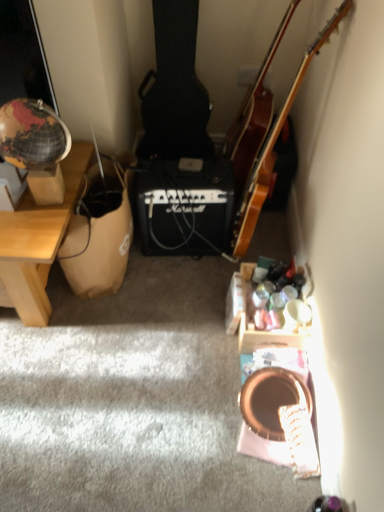
Find the location of a particular element. The width and height of the screenshot is (384, 512). wooden desk at left is located at coordinates (38, 241).

Identify the location of wooden acoustic guitar at upper right. The height and width of the screenshot is (512, 384). (254, 115).

The width and height of the screenshot is (384, 512). What do you see at coordinates (98, 236) in the screenshot?
I see `brown paper bag at left` at bounding box center [98, 236].

Find the location of `wooden desk at left`. wooden desk at left is located at coordinates (38, 241).

In terms of width, does wooden acoustic guitar at upper right look wider or thinner when compared to wooden desk at left?

wooden acoustic guitar at upper right is thinner than wooden desk at left.

Which object is positioned more to the right, wooden acoustic guitar at upper right or wooden desk at left?

wooden acoustic guitar at upper right.

From a real-world perspective, is wooden acoustic guitar at upper right physically located above or below wooden desk at left?

wooden acoustic guitar at upper right is above wooden desk at left.

Is wooden desk at left completely or partially inside wooden acoustic guitar at upper right?

Actually, wooden desk at left is outside wooden acoustic guitar at upper right.

From their relative heights in the image, would you say wooden acoustic guitar at upper right is taller or shorter than wooden desk at left?

In the image, wooden acoustic guitar at upper right appears to be taller than wooden desk at left.

From the image's perspective, would you say wooden acoustic guitar at upper right is shown under wooden desk at left?

No.

Between wooden acoustic guitar at upper right and wooden desk at left, which one has larger size?

wooden desk at left is bigger.

Based on the photo, between brown paper bag at left and wooden desk at left, which one appears on the left side from the viewer's perspective?

wooden desk at left.

Which is behind, brown paper bag at left or wooden desk at left?

brown paper bag at left is further from the camera.

In terms of height, does brown paper bag at left look taller or shorter compared to wooden desk at left?

Clearly, brown paper bag at left is shorter compared to wooden desk at left.

Is brown paper bag at left surrounding wooden desk at left?

No, wooden desk at left is not surrounded by brown paper bag at left.

From a real-world perspective, who is located higher, wooden desk at left or wooden acoustic guitar at upper right?

wooden acoustic guitar at upper right is physically above.

Is wooden desk at left bigger or smaller than wooden acoustic guitar at upper right?

wooden desk at left is bigger than wooden acoustic guitar at upper right.

Locate an element on the screen. The height and width of the screenshot is (512, 384). guitar that appears above the wooden desk at left (from the image's perspective) is located at coordinates (266, 132).

Does wooden desk at left turn towards wooden acoustic guitar at upper right?

No, wooden desk at left is not facing towards wooden acoustic guitar at upper right.

Who is taller, wooden desk at left or brown paper bag at left?

wooden desk at left.

Considering the sizes of objects wooden desk at left and brown paper bag at left in the image provided, who is smaller, wooden desk at left or brown paper bag at left?

brown paper bag at left is smaller.

Do you think wooden desk at left is within brown paper bag at left, or outside of it?

wooden desk at left is located beyond the bounds of brown paper bag at left.

In the image, is wooden desk at left on the left side or the right side of brown paper bag at left?

Clearly, wooden desk at left is on the left of brown paper bag at left in the image.

From the image's perspective, which is above, brown paper bag at left or wooden acoustic guitar at upper right?

From the image's view, wooden acoustic guitar at upper right is above.

This screenshot has height=512, width=384. Identify the location of cardboard box below the wooden acoustic guitar at upper right (from the image's perspective). (98, 236).

Which of these two, wooden acoustic guitar at upper right or wooden acoustic guitar at upper right, stands shorter?

wooden acoustic guitar at upper right is shorter.

Considering the relative positions of wooden acoustic guitar at upper right and wooden acoustic guitar at upper right in the image provided, is wooden acoustic guitar at upper right behind wooden acoustic guitar at upper right?

Yes, the depth of wooden acoustic guitar at upper right is greater than that of wooden acoustic guitar at upper right.

Is wooden acoustic guitar at upper right facing away from wooden acoustic guitar at upper right?

No, wooden acoustic guitar at upper right is not at the back of wooden acoustic guitar at upper right.

Looking at this image, from a real-world perspective, is wooden acoustic guitar at upper right above or below wooden acoustic guitar at upper right?

In terms of real-world spatial position, wooden acoustic guitar at upper right is above wooden acoustic guitar at upper right.

Locate an element on the screen. Image resolution: width=384 pixels, height=512 pixels. guitar that appears above the wooden desk at left (from the image's perspective) is located at coordinates (266, 132).

What are the coordinates of `desk lying in front of the wooden acoustic guitar at upper right` in the screenshot? It's located at (38, 241).

Based on the photo, when comparing their distances from wooden desk at left, does wooden acoustic guitar at upper right or wooden acoustic guitar at upper right seem further?

wooden acoustic guitar at upper right is positioned further to the anchor wooden desk at left.

Looking at the image, which one is located further to brown paper bag at left, wooden acoustic guitar at upper right or wooden acoustic guitar at upper right?

wooden acoustic guitar at upper right is positioned further to the anchor brown paper bag at left.

From the image, which object appears to be nearer to wooden desk at left, wooden acoustic guitar at upper right or brown paper bag at left?

Among the two, brown paper bag at left is located nearer to wooden desk at left.

From the image, which object appears to be nearer to brown paper bag at left, wooden desk at left or wooden acoustic guitar at upper right?

Based on the image, wooden desk at left appears to be nearer to brown paper bag at left.

Based on their spatial positions, is brown paper bag at left or wooden acoustic guitar at upper right further from wooden acoustic guitar at upper right?

brown paper bag at left is positioned further to the anchor wooden acoustic guitar at upper right.

Looking at the image, which one is located closer to wooden acoustic guitar at upper right, wooden acoustic guitar at upper right or brown paper bag at left?

Based on the image, wooden acoustic guitar at upper right appears to be nearer to wooden acoustic guitar at upper right.

When comparing their distances from brown paper bag at left, does wooden acoustic guitar at upper right or wooden acoustic guitar at upper right seem further?

wooden acoustic guitar at upper right is further to brown paper bag at left.

From the image, which object appears to be farther from wooden acoustic guitar at upper right, wooden desk at left or wooden acoustic guitar at upper right?

wooden desk at left is positioned further to the anchor wooden acoustic guitar at upper right.

The height and width of the screenshot is (512, 384). Identify the location of cardboard box situated between wooden desk at left and wooden acoustic guitar at upper right from left to right. (98, 236).

Where is `guitar situated between brown paper bag at left and wooden acoustic guitar at upper right from left to right`? Image resolution: width=384 pixels, height=512 pixels. guitar situated between brown paper bag at left and wooden acoustic guitar at upper right from left to right is located at coordinates (266, 132).

At what (x,y) coordinates should I click in order to perform the action: click on guitar located between wooden desk at left and wooden acoustic guitar at upper right in the left-right direction. Please return your answer as a coordinate pair (x, y). Looking at the image, I should click on (266, 132).

Find the location of a particular element. The height and width of the screenshot is (512, 384). cardboard box between wooden desk at left and wooden acoustic guitar at upper right in the horizontal direction is located at coordinates (98, 236).